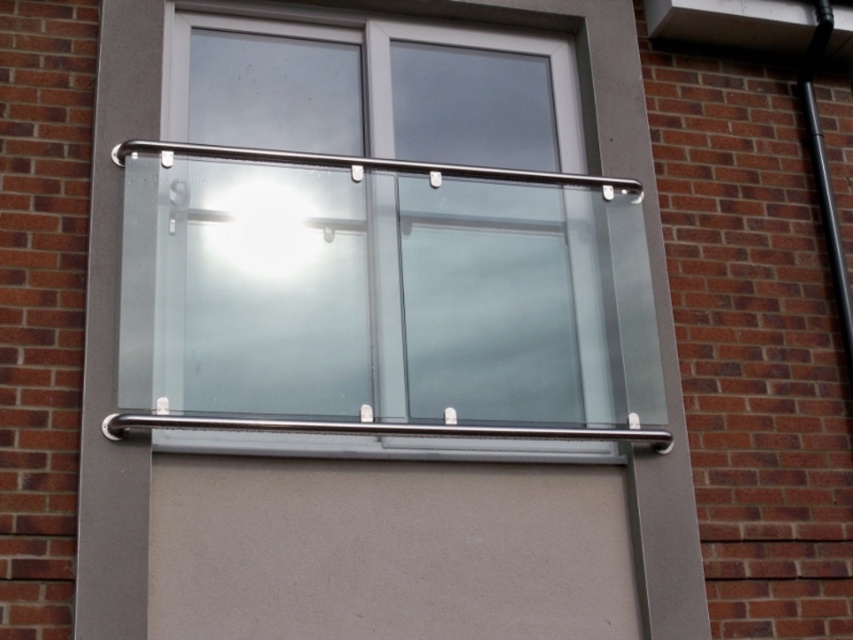
You are an architect designing a new building and want to ensure the clear glass window at center and the satin stainless steel handrail at center meet safety standards. According to the building code, the handrail must be wider than the window it surrounds. Does the current design comply with this requirement?

The clear glass window at center has a width less than the satin stainless steel handrail at center, so the design complies with the safety standard requiring the handrail to be wider than the window it surrounds.

Consider the image. You are standing in front of the building and want to look through the clear glass window at center. Can you see the satin stainless steel handrail at upper center through the window?

The clear glass window at center is in front of the satin stainless steel handrail at upper center, so yes, you can see the satin stainless steel handrail at upper center through the window.

You are a window installer assessing the exterior of a building. You need to replace the clear glass window at center and the satin stainless steel handrail at upper center. Which object requires a larger replacement piece?

The clear glass window at center requires a larger replacement piece because it is larger in size than the satin stainless steel handrail at upper center.